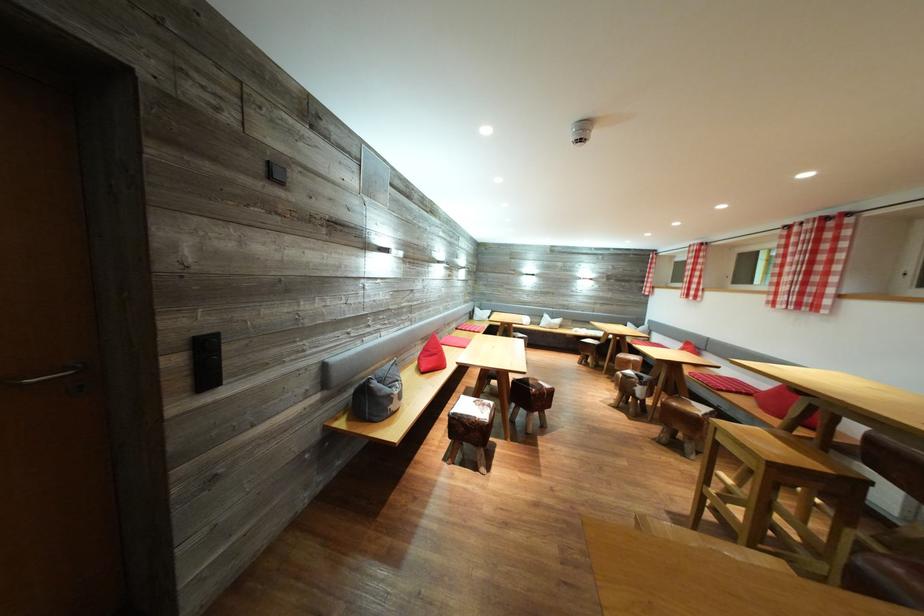
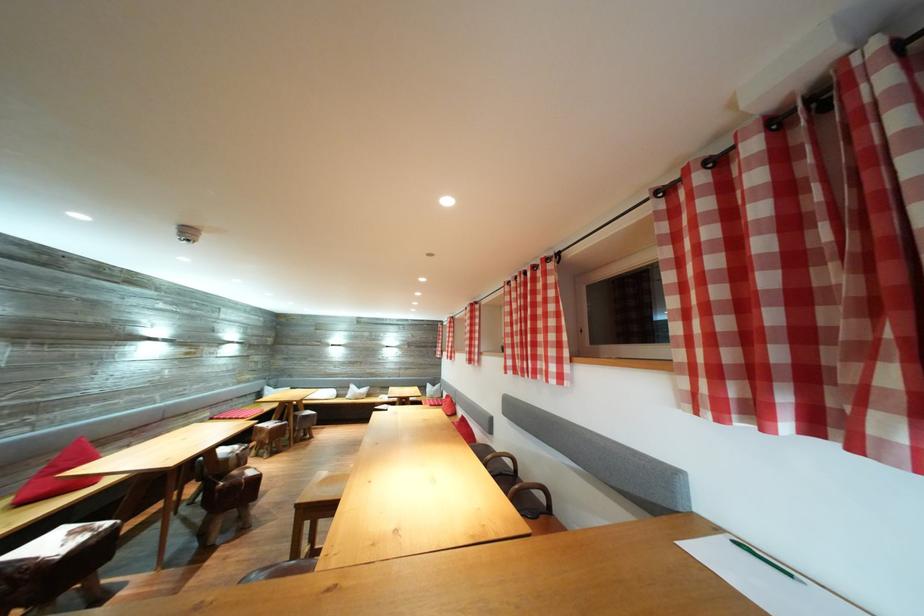
Where in the second image is the point corresponding to point 538,387 from the first image?

(241, 477)